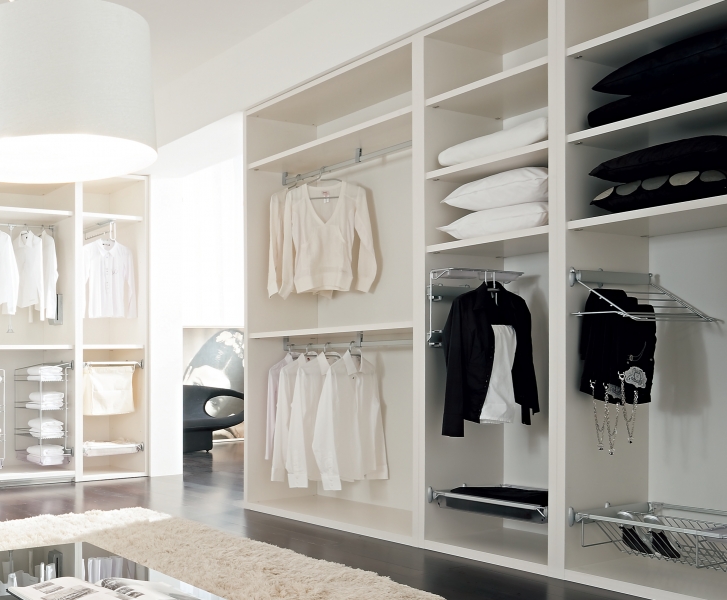
Find the location of `pillow with various gray circles`. pillow with various gray circles is located at coordinates (646, 186).